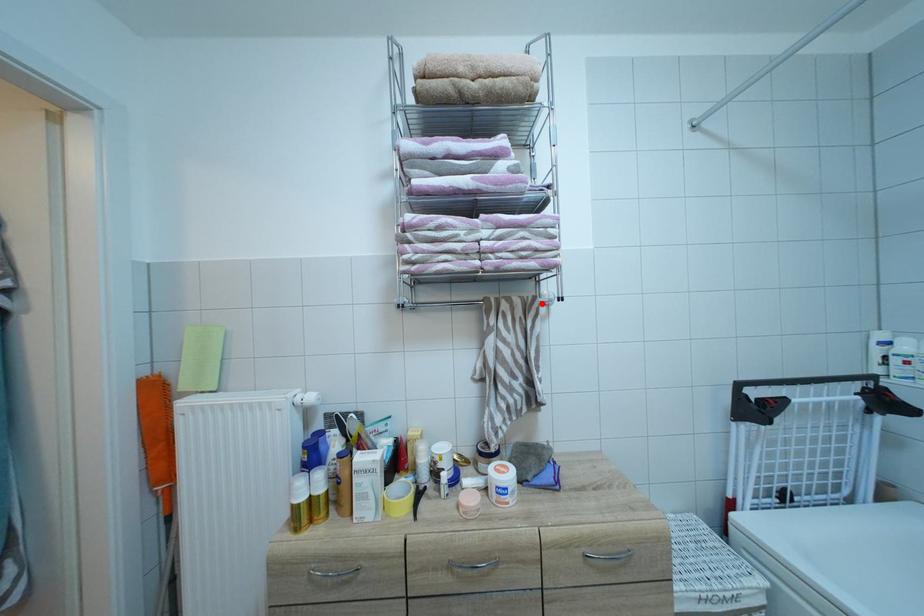
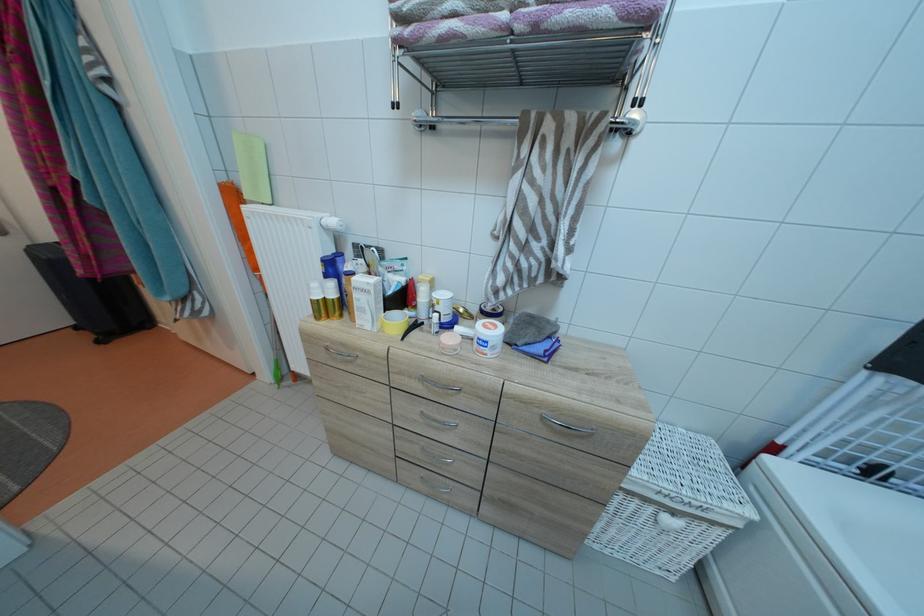
The point at the highlighted location is marked in the first image. Where is the corresponding point in the second image?

(611, 120)